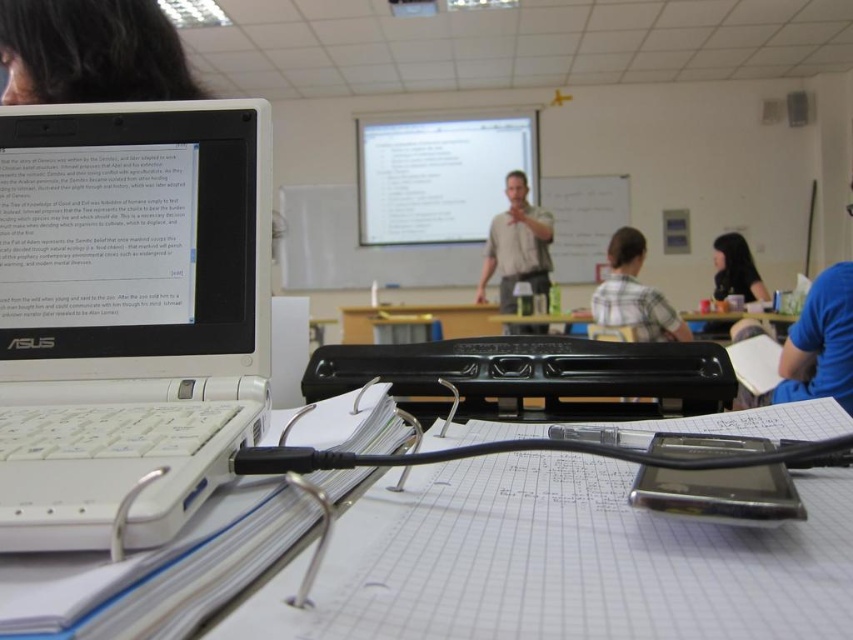
You are a student sitting at the desk in the classroom. You notice two figures in the background. Which one is closer to you, the light beige shirt at center or the black hair at upper right?

The light beige shirt at center is closer to you because it is positioned over the black hair at upper right, indicating it is in front.

You are a student in the classroom and want to identify which object is bigger between the blue fabric shirt at right and the black hair at upper right. Based on the scene, which one is larger?

The blue fabric shirt at right is larger than the black hair at upper right.

You are a student sitting in the classroom. You notice the whiteboard at center and the light beige shirt at center. Which object is positioned higher in the image?

The whiteboard at center is positioned higher than the light beige shirt at center in the image.